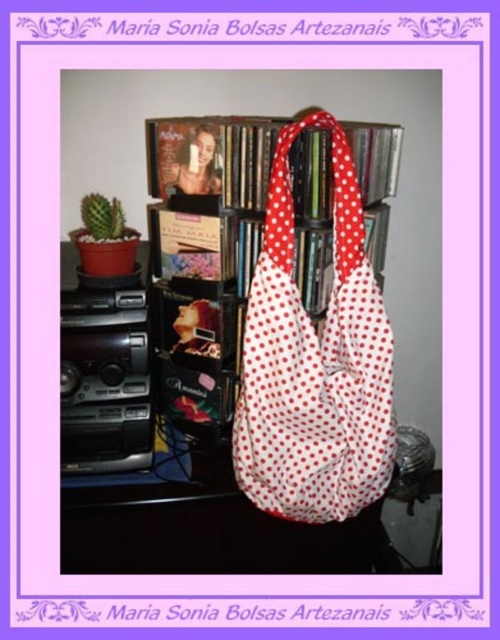
Question: Is white fabric bag at center closer to the viewer compared to white polka dot fabric shoulder bag at center?

Choices:
 (A) yes
 (B) no

Answer: (B)

Question: Which point appears closest to the camera in this image?

Choices:
 (A) (116, 524)
 (B) (298, 486)

Answer: (B)

Question: Can you confirm if white fabric bag at center is bigger than white polka dot fabric shoulder bag at center?

Choices:
 (A) yes
 (B) no

Answer: (A)

Question: Which point is closer to the camera taking this photo?

Choices:
 (A) (307, 454)
 (B) (250, 300)

Answer: (B)

Question: Does white fabric bag at center come in front of white polka dot fabric shoulder bag at center?

Choices:
 (A) no
 (B) yes

Answer: (A)